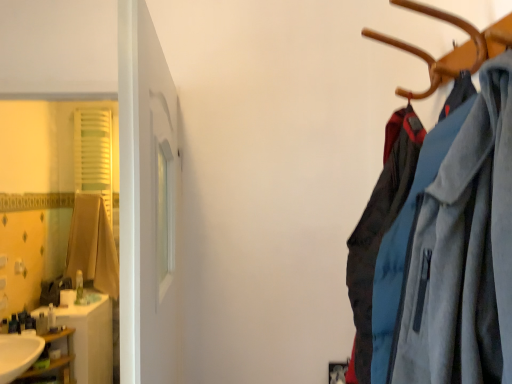
What is the approximate width of matte brown cardigan at left?

7.08 inches.

The image size is (512, 384). Describe the element at coordinates (23, 319) in the screenshot. I see `translucent plastic soap at left, placed as the 4th toiletry when sorted from back to front` at that location.

The height and width of the screenshot is (384, 512). What do you see at coordinates (4, 326) in the screenshot?
I see `translucent plastic soap at left, which is counted as the 5th toiletry, starting from the right` at bounding box center [4, 326].

Find the location of `translucent plastic bottle at left, which ranks as the 5th toiletry in front-to-back order`. translucent plastic bottle at left, which ranks as the 5th toiletry in front-to-back order is located at coordinates (79, 287).

What do you see at coordinates (55, 360) in the screenshot? Image resolution: width=512 pixels, height=384 pixels. I see `wooden shelf at lower left` at bounding box center [55, 360].

In order to face wooden shelf at lower left, should I rotate leftwards or rightwards?

Rotate left and turn 27.353 degrees.

In order to face translucent plastic soap at left, acting as the third toiletry starting from the front, should I rotate leftwards or rightwards?

To align with it, rotate left about 29.660°.

Where is `translucent plastic soap dispenser at left, acting as the 2th toiletry starting from the back`? translucent plastic soap dispenser at left, acting as the 2th toiletry starting from the back is located at coordinates (51, 317).

Between translucent plastic soap dispenser at left, the 4th toiletry from the left, and translucent plastic soap at left, the 3th toiletry from the right, which one has smaller size?

With smaller size is translucent plastic soap at left, the 3th toiletry from the right.

How different are the orientations of translucent plastic soap dispenser at left, acting as the 2th toiletry starting from the back, and translucent plastic soap at left, the 3th toiletry from the right, in degrees?

The facing directions of translucent plastic soap dispenser at left, acting as the 2th toiletry starting from the back, and translucent plastic soap at left, the 3th toiletry from the right, are 88 degrees apart.

Would you say translucent plastic soap at left, placed as the third toiletry when sorted from left to right, is part of translucent plastic soap dispenser at left, the fourth toiletry positioned from the front,'s contents?

No, translucent plastic soap dispenser at left, the fourth toiletry positioned from the front, does not contain translucent plastic soap at left, placed as the third toiletry when sorted from left to right.

Does translucent plastic soap dispenser at left, the fourth toiletry positioned from the front, appear on the left side of translucent plastic soap at left, placed as the 4th toiletry when sorted from back to front?

No, translucent plastic soap dispenser at left, the fourth toiletry positioned from the front, is not to the left of translucent plastic soap at left, placed as the 4th toiletry when sorted from back to front.

In the image, is translucent plastic bottle at left, which is the 1th toiletry in right-to-left order, on the left side or the right side of white glossy sink at lower left?

From the image, it's evident that translucent plastic bottle at left, which is the 1th toiletry in right-to-left order, is to the left of white glossy sink at lower left.

From the image's perspective, is translucent plastic bottle at left, which ranks as the 5th toiletry in front-to-back order, below white glossy sink at lower left?

No, from the image's perspective, translucent plastic bottle at left, which ranks as the 5th toiletry in front-to-back order, is not below white glossy sink at lower left.

Is translucent plastic bottle at left, placed as the 5th toiletry when sorted from left to right, turned away from white glossy sink at lower left?

No, white glossy sink at lower left is not at the back of translucent plastic bottle at left, placed as the 5th toiletry when sorted from left to right.

From a real-world perspective, is translucent plastic bottle at left, which is the 1th toiletry in right-to-left order, located beneath translucent plastic soap dispenser at left, the second toiletry in the right-to-left sequence?

No, from a real-world perspective, translucent plastic bottle at left, which is the 1th toiletry in right-to-left order, is not beneath translucent plastic soap dispenser at left, the second toiletry in the right-to-left sequence.

Considering the relative sizes of translucent plastic bottle at left, acting as the first toiletry starting from the back, and translucent plastic soap dispenser at left, the fourth toiletry positioned from the front, in the image provided, is translucent plastic bottle at left, acting as the first toiletry starting from the back, shorter than translucent plastic soap dispenser at left, the fourth toiletry positioned from the front,?

No.

Could you tell me if translucent plastic bottle at left, placed as the 5th toiletry when sorted from left to right, is facing translucent plastic soap dispenser at left, the 4th toiletry from the left?

No, translucent plastic bottle at left, placed as the 5th toiletry when sorted from left to right, is not oriented towards translucent plastic soap dispenser at left, the 4th toiletry from the left.

In the scene shown: Is translucent plastic bottle at left, acting as the first toiletry starting from the back, far from translucent plastic soap dispenser at left, the 4th toiletry from the left?

That's not correct — translucent plastic bottle at left, acting as the first toiletry starting from the back, is a little close to translucent plastic soap dispenser at left, the 4th toiletry from the left.

Is point (5, 360) less distant than point (78, 205)?

Yes, it is in front of point (78, 205).

From the image's perspective, is white glossy sink at lower left below matte brown cardigan at left?

Correct, white glossy sink at lower left appears lower than matte brown cardigan at left in the image.

Considering the relative positions of white glossy sink at lower left and matte brown cardigan at left in the image provided, is white glossy sink at lower left in front of matte brown cardigan at left?

Yes, white glossy sink at lower left is closer to the camera.

Considering the relative sizes of white glossy sink at lower left and matte brown cardigan at left in the image provided, is white glossy sink at lower left taller than matte brown cardigan at left?

In fact, white glossy sink at lower left may be shorter than matte brown cardigan at left.

Which is nearer, (6,364) or (69,362)?

The point (6,364) is closer.

How far apart are white glossy sink at lower left and wooden shelf at lower left?

They are 9.60 inches apart.

Considering the relative sizes of white glossy sink at lower left and wooden shelf at lower left in the image provided, is white glossy sink at lower left wider than wooden shelf at lower left?

No, white glossy sink at lower left is not wider than wooden shelf at lower left.

Is white glossy sink at lower left looking in the opposite direction of wooden shelf at lower left?

white glossy sink at lower left does not have its back to wooden shelf at lower left.

In the scene shown: Would you say translucent plastic soap at left, which is counted as the 5th toiletry, starting from the right, is inside or outside matte brown cardigan at left?

translucent plastic soap at left, which is counted as the 5th toiletry, starting from the right, is not inside matte brown cardigan at left, it's outside.

How different are the orientations of translucent plastic soap at left, marked as the first toiletry in a left-to-right arrangement, and matte brown cardigan at left in degrees?

They differ by 89.4 degrees in their facing directions.

Who is smaller, translucent plastic soap at left, placed as the 1th toiletry when sorted from front to back, or matte brown cardigan at left?

translucent plastic soap at left, placed as the 1th toiletry when sorted from front to back.

Can you tell me how much translucent plastic bottle at left, which ranks as the 5th toiletry in front-to-back order, and translucent plastic soap at left, acting as the 3th toiletry starting from the back, differ in facing direction?

The angle between the facing direction of translucent plastic bottle at left, which ranks as the 5th toiletry in front-to-back order, and the facing direction of translucent plastic soap at left, acting as the 3th toiletry starting from the back, is 5 degrees.

Is translucent plastic bottle at left, acting as the first toiletry starting from the back, looking in the opposite direction of translucent plastic soap at left, which appears as the 2th toiletry when viewed from the left?

No, translucent plastic bottle at left, acting as the first toiletry starting from the back,'s orientation is not away from translucent plastic soap at left, which appears as the 2th toiletry when viewed from the left.

Considering the relative sizes of translucent plastic bottle at left, acting as the first toiletry starting from the back, and translucent plastic soap at left, which appears as the 2th toiletry when viewed from the left, in the image provided, is translucent plastic bottle at left, acting as the first toiletry starting from the back, wider than translucent plastic soap at left, which appears as the 2th toiletry when viewed from the left,?

Yes, translucent plastic bottle at left, acting as the first toiletry starting from the back, is wider than translucent plastic soap at left, which appears as the 2th toiletry when viewed from the left.

Can we say translucent plastic bottle at left, which is the 1th toiletry in right-to-left order, lies outside translucent plastic soap at left, which appears as the 2th toiletry when viewed from the left?

Yes, translucent plastic bottle at left, which is the 1th toiletry in right-to-left order, is outside of translucent plastic soap at left, which appears as the 2th toiletry when viewed from the left.

You are a GUI agent. You are given a task and a screenshot of the screen. Output one action in this format:
    pyautogui.click(x=<x>, y=<y>)
    Task: Click on the 1st toiletry counting from the right side of the translucent plastic soap at left, the 3th toiletry from the right
    Image resolution: width=512 pixels, height=384 pixels.
    Given the screenshot: What is the action you would take?
    pyautogui.click(x=51, y=317)

The height and width of the screenshot is (384, 512). What are the coordinates of `the 5th toiletry above the white glossy sink at lower left (from a real-world perspective)` in the screenshot? It's located at (79, 287).

Looking at the image, which one is located further to wooden shelf at lower left, matte brown cardigan at left or translucent plastic soap dispenser at left, acting as the 2th toiletry starting from the back?

matte brown cardigan at left.

Looking at the image, which one is located further to translucent plastic soap dispenser at left, the second toiletry in the right-to-left sequence, matte brown cardigan at left or wooden shelf at lower left?

matte brown cardigan at left lies further to translucent plastic soap dispenser at left, the second toiletry in the right-to-left sequence, than the other object.

Considering their positions, is translucent plastic soap at left, placed as the 4th toiletry when sorted from back to front, positioned closer to translucent plastic bottle at left, which ranks as the 5th toiletry in front-to-back order, than translucent plastic soap at left, which is the 4th toiletry from right to left?

Among the two, translucent plastic soap at left, placed as the 4th toiletry when sorted from back to front, is located nearer to translucent plastic bottle at left, which ranks as the 5th toiletry in front-to-back order.

From the image, which object appears to be nearer to white glossy sink at lower left, translucent plastic soap at left, which is the 4th toiletry from right to left, or translucent plastic soap at left, placed as the third toiletry when sorted from left to right?

translucent plastic soap at left, which is the 4th toiletry from right to left, is positioned closer to the anchor white glossy sink at lower left.

From the image, which object appears to be nearer to translucent plastic soap at left, marked as the first toiletry in a left-to-right arrangement, matte brown cardigan at left or translucent plastic soap dispenser at left, the 4th toiletry from the left?

Among the two, translucent plastic soap dispenser at left, the 4th toiletry from the left, is located nearer to translucent plastic soap at left, marked as the first toiletry in a left-to-right arrangement.

Based on their spatial positions, is translucent plastic bottle at left, placed as the 5th toiletry when sorted from left to right, or translucent plastic soap at left, placed as the third toiletry when sorted from left to right, closer to wooden shelf at lower left?

translucent plastic soap at left, placed as the third toiletry when sorted from left to right.

Consider the image. Considering their positions, is translucent plastic bottle at left, which is the 1th toiletry in right-to-left order, positioned further to translucent plastic soap dispenser at left, the fourth toiletry positioned from the front, than wooden shelf at lower left?

translucent plastic bottle at left, which is the 1th toiletry in right-to-left order, is further to translucent plastic soap dispenser at left, the fourth toiletry positioned from the front.

From the image, which object appears to be farther from translucent plastic soap at left, placed as the third toiletry when sorted from left to right, translucent plastic soap at left, which appears as the 2th toiletry when viewed from the left, or wooden shelf at lower left?

wooden shelf at lower left is further to translucent plastic soap at left, placed as the third toiletry when sorted from left to right.

Locate an element on the screen. toiletry between translucent plastic soap at left, which is the 4th toiletry from right to left, and wooden shelf at lower left in the up-down direction is located at coordinates (4, 326).

The height and width of the screenshot is (384, 512). Identify the location of shelf between white glossy sink at lower left and translucent plastic soap dispenser at left, the fourth toiletry positioned from the front, from front to back. (55, 360).

Image resolution: width=512 pixels, height=384 pixels. Identify the location of toiletry between translucent plastic soap at left, which is the 4th toiletry from right to left, and translucent plastic soap dispenser at left, acting as the 2th toiletry starting from the back. (23, 319).

I want to click on toiletry between white glossy sink at lower left and translucent plastic soap at left, the 3th toiletry from the right, from front to back, so click(4, 326).